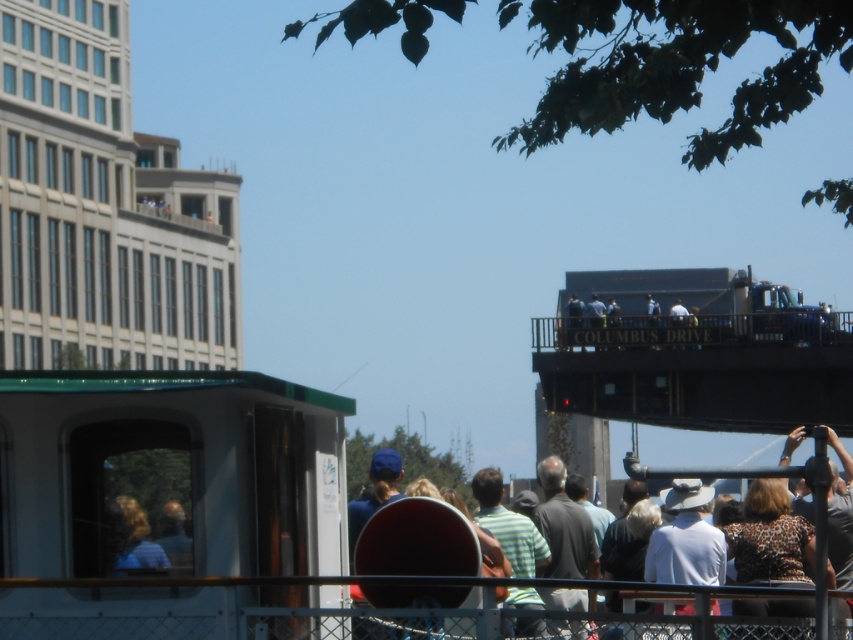
Question: Which point appears closest to the camera in this image?

Choices:
 (A) (368, 440)
 (B) (271, 600)
 (C) (734, 561)

Answer: (B)

Question: Is green matte train car at left positioned behind dark gray casual clothing at center?

Choices:
 (A) no
 (B) yes

Answer: (B)

Question: From the image, what is the correct spatial relationship of dark gray casual clothing at center in relation to blonde hair at left?

Choices:
 (A) below
 (B) above

Answer: (A)

Question: Is green matte train car at left further to the viewer compared to blonde hair at left?

Choices:
 (A) yes
 (B) no

Answer: (B)

Question: Which point is farther to the camera?

Choices:
 (A) green matte train car at left
 (B) dark gray casual clothing at center

Answer: (A)

Question: Among these objects, which one is farthest from the camera?

Choices:
 (A) brown leopard print shirt at lower right
 (B) green matte train car at left

Answer: (B)